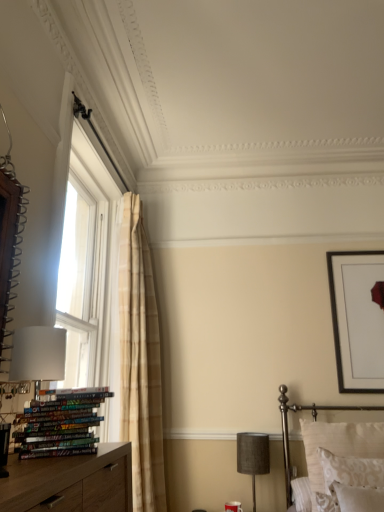
Describe the element at coordinates (357, 319) in the screenshot. This screenshot has width=384, height=512. I see `black matte picture frame at upper right` at that location.

Measure the distance between patterned fabric pillow at lower right and camera.

A distance of 5.96 feet exists between patterned fabric pillow at lower right and camera.

What do you see at coordinates (314, 420) in the screenshot? I see `white textured pillows at lower right` at bounding box center [314, 420].

The height and width of the screenshot is (512, 384). What do you see at coordinates (38, 354) in the screenshot?
I see `white matte table lamp at left, which ranks as the second table lamp in bottom-to-top order` at bounding box center [38, 354].

The image size is (384, 512). Find the location of `black matte picture frame at upper right`. black matte picture frame at upper right is located at coordinates (357, 319).

Considering the sizes of black matte picture frame at upper right and textured gray lampshade at lower right, arranged as the 2th table lamp when viewed from the top, in the image, is black matte picture frame at upper right taller or shorter than textured gray lampshade at lower right, arranged as the 2th table lamp when viewed from the top,?

black matte picture frame at upper right is taller than textured gray lampshade at lower right, arranged as the 2th table lamp when viewed from the top.

Does black matte picture frame at upper right have a greater width compared to textured gray lampshade at lower right, which is the 1th table lamp in right-to-left order?

No, black matte picture frame at upper right is not wider than textured gray lampshade at lower right, which is the 1th table lamp in right-to-left order.

In the scene shown: What's the angular difference between black matte picture frame at upper right and textured gray lampshade at lower right, placed as the second table lamp when sorted from front to back,'s facing directions?

There is a 0.506-degree angle between the facing directions of black matte picture frame at upper right and textured gray lampshade at lower right, placed as the second table lamp when sorted from front to back.

Which is closer to the camera, (363, 361) or (253, 459)?

Point (363, 361).

Which object is positioned more to the left, textured gray lampshade at lower right, placed as the second table lamp when sorted from front to back, or white textured pillows at lower right?

Answer: Positioned to the left is textured gray lampshade at lower right, placed as the second table lamp when sorted from front to back.

Is the position of textured gray lampshade at lower right, which is the 1th table lamp in right-to-left order, less distant than that of white textured pillows at lower right?

No, textured gray lampshade at lower right, which is the 1th table lamp in right-to-left order, is further to the viewer.

Where is `bed above the textured gray lampshade at lower right, placed as the second table lamp when sorted from front to back (from the image's perspective)`? The width and height of the screenshot is (384, 512). bed above the textured gray lampshade at lower right, placed as the second table lamp when sorted from front to back (from the image's perspective) is located at coordinates (314, 420).

Would you say textured gray lampshade at lower right, the 1th table lamp positioned from the back, contains white textured pillows at lower right?

No, white textured pillows at lower right is located outside of textured gray lampshade at lower right, the 1th table lamp positioned from the back.

Considering the relative sizes of black matte picture frame at upper right and white textured pillows at lower right in the image provided, is black matte picture frame at upper right bigger than white textured pillows at lower right?

Actually, black matte picture frame at upper right might be smaller than white textured pillows at lower right.

Find the location of `picture frame lying behind the white textured pillows at lower right`. picture frame lying behind the white textured pillows at lower right is located at coordinates (357, 319).

Is black matte picture frame at upper right inside the boundaries of white textured pillows at lower right, or outside?

black matte picture frame at upper right is not inside white textured pillows at lower right, it's outside.

Considering the relative sizes of black matte picture frame at upper right and white textured pillows at lower right in the image provided, is black matte picture frame at upper right taller than white textured pillows at lower right?

Yes, black matte picture frame at upper right is taller than white textured pillows at lower right.

Based on the photo, from the image's perspective, is white textured pillows at lower right above or below black matte picture frame at upper right?

Clearly, from the image's perspective, white textured pillows at lower right is below black matte picture frame at upper right.

In terms of width, does white textured pillows at lower right look wider or thinner when compared to black matte picture frame at upper right?

In the image, white textured pillows at lower right appears to be wider than black matte picture frame at upper right.

Considering the sizes of objects white textured pillows at lower right and black matte picture frame at upper right in the image provided, who is taller, white textured pillows at lower right or black matte picture frame at upper right?

Standing taller between the two is black matte picture frame at upper right.

Considering the positions of objects white textured pillows at lower right and black matte picture frame at upper right in the image provided, who is more to the left, white textured pillows at lower right or black matte picture frame at upper right?

white textured pillows at lower right is more to the left.

From a real-world perspective, is textured gray lampshade at lower right, the 2th table lamp when ordered from left to right, under white matte table lamp at left, which ranks as the second table lamp in bottom-to-top order?

Yes, from a real-world perspective, textured gray lampshade at lower right, the 2th table lamp when ordered from left to right, is below white matte table lamp at left, which ranks as the second table lamp in bottom-to-top order.

Is textured gray lampshade at lower right, arranged as the 2th table lamp when viewed from the top, far away from white matte table lamp at left, acting as the 1th table lamp starting from the top?

Absolutely, textured gray lampshade at lower right, arranged as the 2th table lamp when viewed from the top, is distant from white matte table lamp at left, acting as the 1th table lamp starting from the top.

From the image's perspective, between textured gray lampshade at lower right, arranged as the 2th table lamp when viewed from the top, and white matte table lamp at left, the 1th table lamp from the front, who is located below?

textured gray lampshade at lower right, arranged as the 2th table lamp when viewed from the top, from the image's perspective.

From their relative heights in the image, would you say textured gray lampshade at lower right, the 1th table lamp positioned from the back, is taller or shorter than white matte table lamp at left, marked as the 2th table lamp in a right-to-left arrangement?

Clearly, textured gray lampshade at lower right, the 1th table lamp positioned from the back, is taller compared to white matte table lamp at left, marked as the 2th table lamp in a right-to-left arrangement.

Which object is positioned more to the left, multicolored glossy books at lower left or black matte picture frame at upper right?

multicolored glossy books at lower left is more to the left.

Considering the sizes of objects multicolored glossy books at lower left and black matte picture frame at upper right in the image provided, who is shorter, multicolored glossy books at lower left or black matte picture frame at upper right?

multicolored glossy books at lower left is shorter.

Consider the image. Is textured gray lampshade at lower right, which is the 1th table lamp in right-to-left order, positioned with its back to multicolored glossy books at lower left?

That's not correct — textured gray lampshade at lower right, which is the 1th table lamp in right-to-left order, is not looking away from multicolored glossy books at lower left.

Consider the image. Which object is closer to the camera taking this photo, textured gray lampshade at lower right, which is the 1th table lamp in bottom-to-top order, or multicolored glossy books at lower left?

multicolored glossy books at lower left is more forward.

From a real-world perspective, is textured gray lampshade at lower right, the 2th table lamp when ordered from left to right, positioned over multicolored glossy books at lower left based on gravity?

Incorrect, from a real-world perspective, textured gray lampshade at lower right, the 2th table lamp when ordered from left to right, is lower than multicolored glossy books at lower left.

Considering the relative positions of textured gray lampshade at lower right, which is the 1th table lamp in bottom-to-top order, and multicolored glossy books at lower left in the image provided, is textured gray lampshade at lower right, which is the 1th table lamp in bottom-to-top order, to the left of multicolored glossy books at lower left from the viewer's perspective?

No.

You are a GUI agent. You are given a task and a screenshot of the screen. Output one action in this format:
    pyautogui.click(x=<x>, y=<y>)
    Task: Click on the picture frame behind the textured gray lampshade at lower right, which is the 1th table lamp in right-to-left order
    The width and height of the screenshot is (384, 512).
    Given the screenshot: What is the action you would take?
    pyautogui.click(x=357, y=319)

Where is `bed on the right of textured gray lampshade at lower right, the 2th table lamp when ordered from left to right`? This screenshot has height=512, width=384. bed on the right of textured gray lampshade at lower right, the 2th table lamp when ordered from left to right is located at coordinates point(314,420).

Estimate the real-world distances between objects in this image. Which object is further from textured gray lampshade at lower right, which is the 1th table lamp in right-to-left order, patterned fabric pillow at lower right or black matte picture frame at upper right?

black matte picture frame at upper right is positioned further to the anchor textured gray lampshade at lower right, which is the 1th table lamp in right-to-left order.

Estimate the real-world distances between objects in this image. Which object is further from white matte table lamp at left, marked as the 2th table lamp in a right-to-left arrangement, patterned fabric pillow at lower right or textured gray lampshade at lower right, placed as the second table lamp when sorted from front to back?

Based on the image, textured gray lampshade at lower right, placed as the second table lamp when sorted from front to back, appears to be further to white matte table lamp at left, marked as the 2th table lamp in a right-to-left arrangement.

Consider the image. Considering their positions, is white matte table lamp at left, acting as the 1th table lamp starting from the top, positioned closer to black matte picture frame at upper right than textured gray lampshade at lower right, the 1th table lamp positioned from the back?

textured gray lampshade at lower right, the 1th table lamp positioned from the back, lies closer to black matte picture frame at upper right than the other object.

Looking at the image, which one is located further to textured gray lampshade at lower right, placed as the second table lamp when sorted from front to back, patterned fabric pillow at lower right or white matte table lamp at left, which ranks as the second table lamp in bottom-to-top order?

white matte table lamp at left, which ranks as the second table lamp in bottom-to-top order.

Which object lies nearer to the anchor point black matte picture frame at upper right, white textured pillows at lower right or white matte table lamp at left, the second table lamp viewed from the back?

white textured pillows at lower right is positioned closer to the anchor black matte picture frame at upper right.

Consider the image. Estimate the real-world distances between objects in this image. Which object is further from multicolored glossy books at lower left, patterned fabric pillow at lower right or white matte table lamp at left, marked as the 2th table lamp in a right-to-left arrangement?

patterned fabric pillow at lower right lies further to multicolored glossy books at lower left than the other object.

When comparing their distances from patterned fabric pillow at lower right, does multicolored glossy books at lower left or white textured pillows at lower right seem closer?

white textured pillows at lower right is positioned closer to the anchor patterned fabric pillow at lower right.

From the image, which object appears to be farther from multicolored glossy books at lower left, textured gray lampshade at lower right, arranged as the 2th table lamp when viewed from the top, or black matte picture frame at upper right?

black matte picture frame at upper right lies further to multicolored glossy books at lower left than the other object.

Identify the location of bed situated between white matte table lamp at left, which ranks as the second table lamp in bottom-to-top order, and black matte picture frame at upper right from left to right. (314, 420).

Locate an element on the screen. This screenshot has height=512, width=384. bed between patterned fabric pillow at lower right and textured gray lampshade at lower right, which is the 1th table lamp in bottom-to-top order, from front to back is located at coordinates (314, 420).

You are a GUI agent. You are given a task and a screenshot of the screen. Output one action in this format:
    pyautogui.click(x=<x>, y=<y>)
    Task: Click on the pillow between multicolored glossy books at lower left and white textured pillows at lower right in the horizontal direction
    This screenshot has width=384, height=512.
    Given the screenshot: What is the action you would take?
    pyautogui.click(x=351, y=471)

What are the coordinates of `table lamp between white matte table lamp at left, the second table lamp viewed from the back, and white textured pillows at lower right` in the screenshot? It's located at (253, 457).